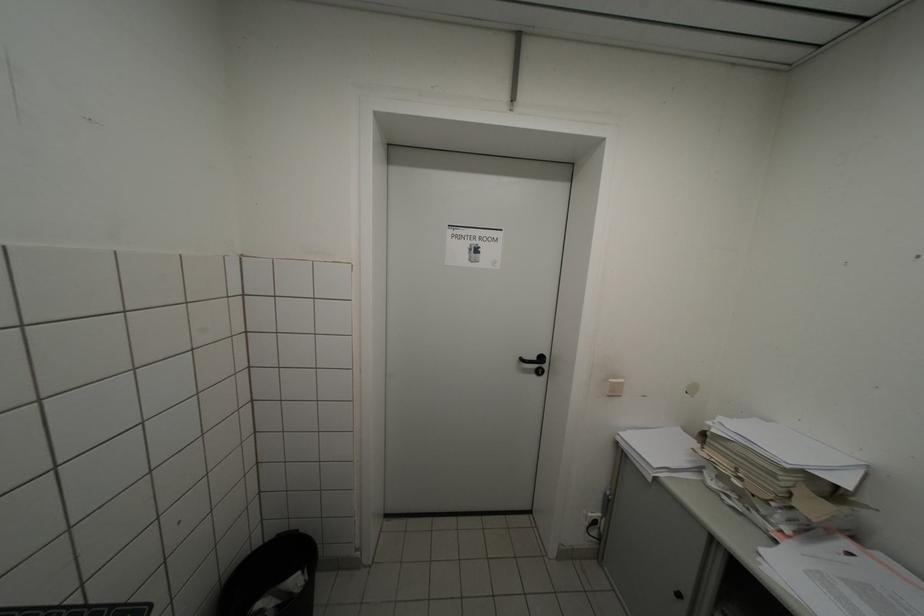
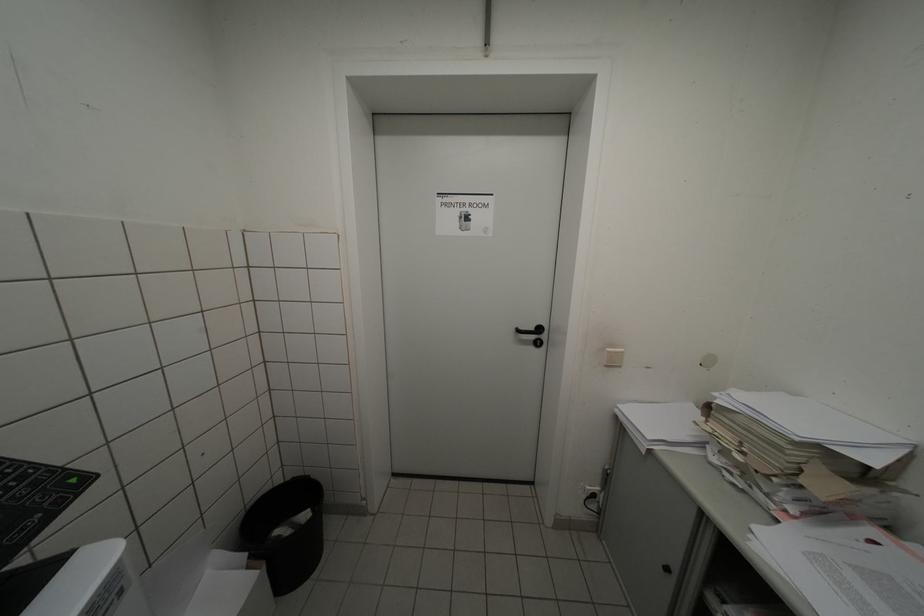
Find the pixel in the second image that matches (x=532, y=361) in the first image.

(529, 331)